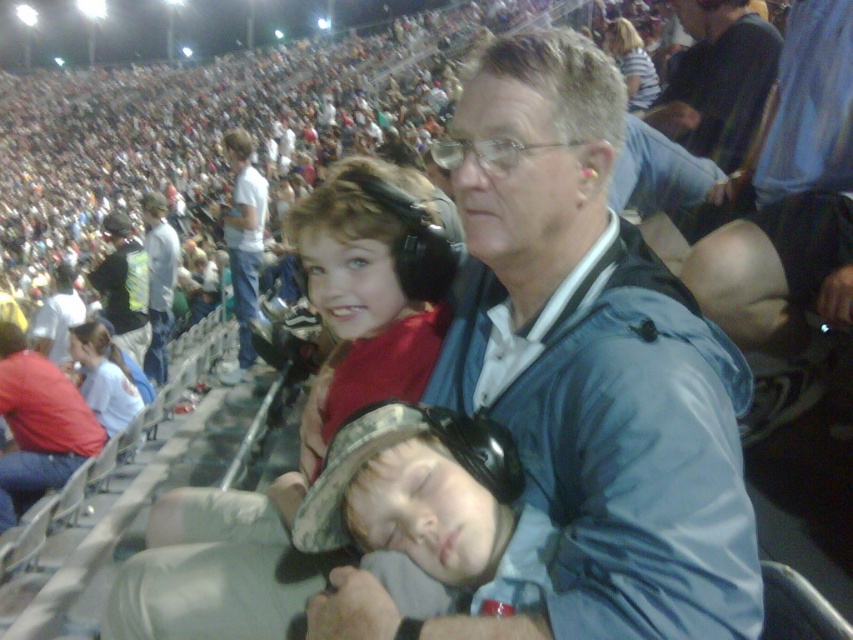
Can you confirm if red shirt at left is bigger than white cotton shirt at upper left?

No.

Can you confirm if red shirt at left is positioned above white cotton shirt at upper left?

Incorrect, red shirt at left is not positioned above white cotton shirt at upper left.

Locate an element on the screen. red shirt at left is located at coordinates (39, 422).

Locate an element on the screen. The height and width of the screenshot is (640, 853). red shirt at left is located at coordinates (39, 422).

Which of these two, matte red shirt at center or dark blue shirt at upper right, stands shorter?

matte red shirt at center

Is matte red shirt at center shorter than dark blue shirt at upper right?

Correct, matte red shirt at center is not as tall as dark blue shirt at upper right.

The image size is (853, 640). Describe the element at coordinates (364, 292) in the screenshot. I see `matte red shirt at center` at that location.

Where is `matte red shirt at center`? The height and width of the screenshot is (640, 853). matte red shirt at center is located at coordinates (364, 292).

Is matte red shirt at center bigger than red shirt at left?

No, matte red shirt at center is not bigger than red shirt at left.

Between matte red shirt at center and red shirt at left, which one appears on the right side from the viewer's perspective?

matte red shirt at center is more to the right.

Does point (328, 192) come behind point (74, 461)?

No, (328, 192) is closer to viewer.

The height and width of the screenshot is (640, 853). In order to click on matte red shirt at center in this screenshot , I will do `click(364, 292)`.